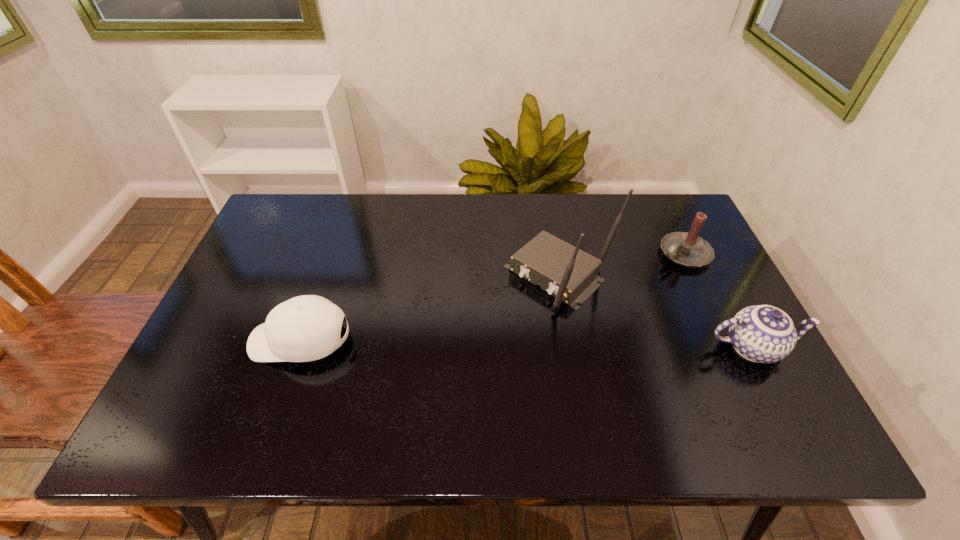
The width and height of the screenshot is (960, 540). I want to click on baseball cap, so click(x=305, y=328).

The height and width of the screenshot is (540, 960). Identify the location of chinaware. (761, 333).

The image size is (960, 540). Identify the location of candle. (688, 249).

Locate an element on the screen. the tallest object is located at coordinates (570, 275).

Locate an element on the screen. the second object from left to right is located at coordinates (570, 275).

Identify the location of free spot located on the front-facing side of the baseball cap. The width and height of the screenshot is (960, 540). (218, 341).

Find the location of `vacant area situated 0.100m on the front-facing side of the baseball cap`. vacant area situated 0.100m on the front-facing side of the baseball cap is located at coordinates (210, 341).

At what (x,y) coordinates should I click in order to perform the action: click on vacant area situated 0.100m on the front-facing side of the baseball cap. Please return your answer as a coordinate pair (x, y). The height and width of the screenshot is (540, 960). Looking at the image, I should click on (210, 341).

Identify the location of vacant area situated 0.370m on the side of the candle with the handle loop. The width and height of the screenshot is (960, 540). (568, 318).

What are the coordinates of `free space located 0.170m on the side of the candle with the handle loop` in the screenshot? It's located at (624, 287).